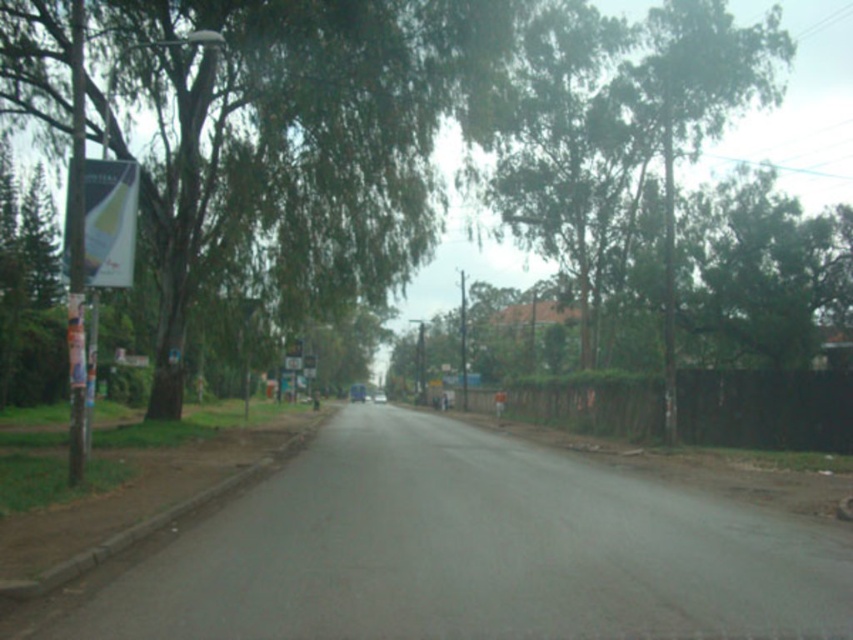
Which is more to the right, green leafy tree at left or white glossy banner at left?

green leafy tree at left is more to the right.

From the picture: Is green leafy tree at left to the left of white glossy banner at left from the viewer's perspective?

No, green leafy tree at left is not to the left of white glossy banner at left.

Which is behind, point (200, 116) or point (68, 221)?

The point (200, 116) is behind.

This screenshot has width=853, height=640. I want to click on green leafy tree at left, so click(x=296, y=141).